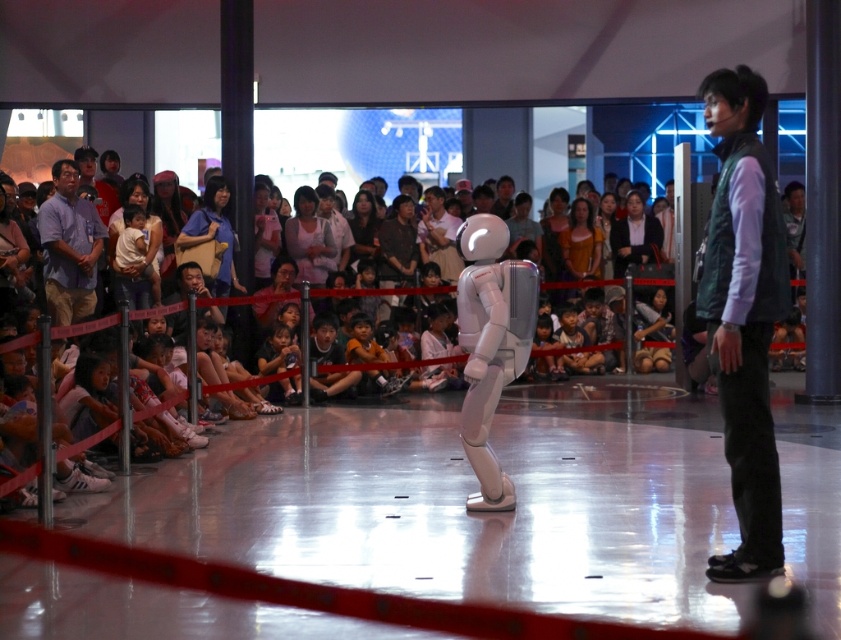
Consider the image. You are organizing a small exhibition and need to place a matte black bag at center and a matte black hair at center on a shelf. Given that the shelf has limited height space, which object should you place first to ensure both can fit without exceeding the height limit?

The matte black bag at center is taller than the matte black hair at center, so you should place the matte black bag at center first to ensure both can fit within the shelf height limit.